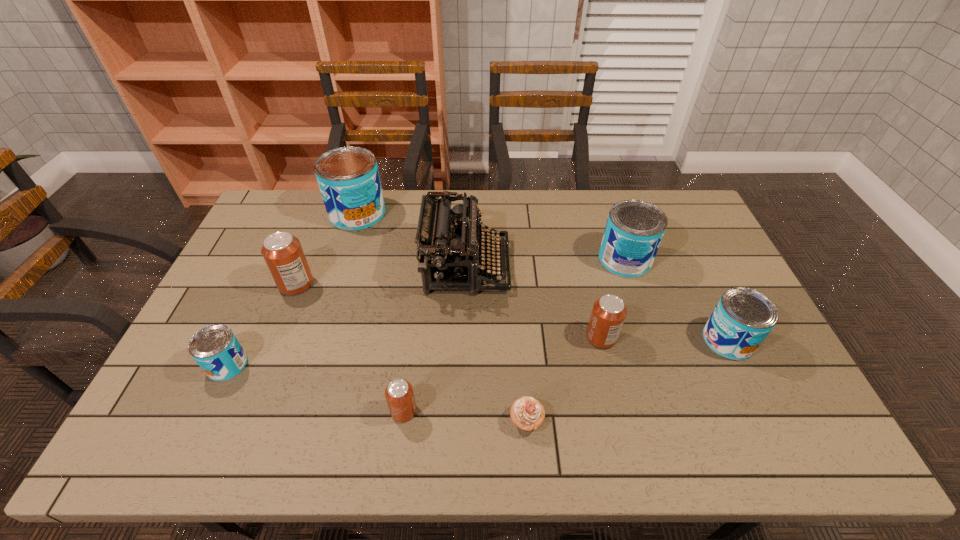
At what (x,y) coordinates should I click in order to perform the action: click on free space that is in between the leftmost blue can and the rightmost orange can. Please return your answer as a coordinate pair (x, y). The height and width of the screenshot is (540, 960). Looking at the image, I should click on (415, 351).

Where is `free spot between the fourth can from right to left and the eighth object from left to right`? The width and height of the screenshot is (960, 540). free spot between the fourth can from right to left and the eighth object from left to right is located at coordinates (515, 335).

Identify which object is the fourth nearest to the leftmost orange can. Please provide its 2D coordinates. Your answer should be formatted as a tuple, i.e. [(x, y)], where the tuple contains the x and y coordinates of a point satisfying the conditions above.

[(399, 394)]

At what (x,y) coordinates should I click in order to perform the action: click on object that is the nearest to the farthest object. Please return your answer as a coordinate pair (x, y). Image resolution: width=960 pixels, height=540 pixels. Looking at the image, I should click on (449, 251).

The height and width of the screenshot is (540, 960). In order to click on can that is the third nearest to the rightmost blue can in this screenshot , I will do `click(399, 394)`.

You are a GUI agent. You are given a task and a screenshot of the screen. Output one action in this format:
    pyautogui.click(x=<x>, y=<y>)
    Task: Click on the fifth closest can to the leftmost blue can
    
    Given the screenshot: What is the action you would take?
    pyautogui.click(x=634, y=230)

Where is `blue can that is the second closest one to the sixth can from left to right`? blue can that is the second closest one to the sixth can from left to right is located at coordinates (348, 178).

Where is `blue can that can be found as the third closest to the eighth object from left to right`? The width and height of the screenshot is (960, 540). blue can that can be found as the third closest to the eighth object from left to right is located at coordinates (215, 348).

Choose which orange can is the third nearest neighbor to the second blue can from right to left. Please provide its 2D coordinates. Your answer should be formatted as a tuple, i.e. [(x, y)], where the tuple contains the x and y coordinates of a point satisfying the conditions above.

[(282, 252)]

Locate which orange can ranks in proximity to the biggest blue can. Please provide its 2D coordinates. Your answer should be formatted as a tuple, i.e. [(x, y)], where the tuple contains the x and y coordinates of a point satisfying the conditions above.

[(282, 252)]